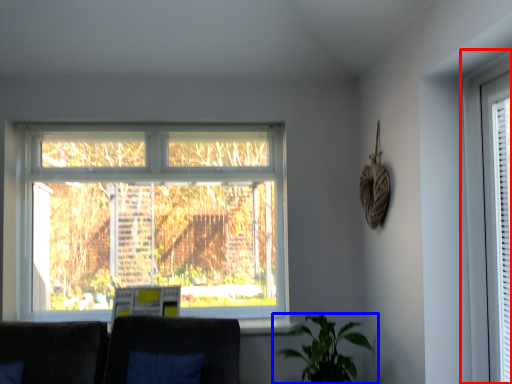
Question: Which object is further to the camera taking this photo, window (highlighted by a red box) or houseplant (highlighted by a blue box)?

Choices:
 (A) window
 (B) houseplant

Answer: (B)